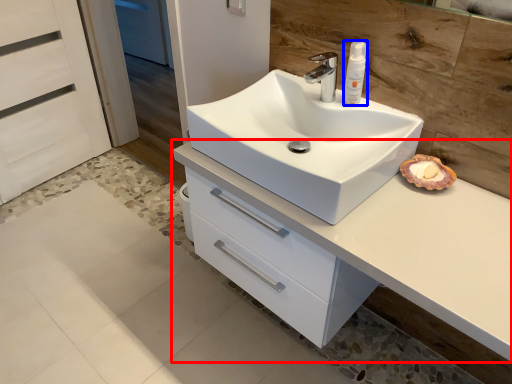
Question: Which point is closer to the camera, bathroom cabinet (highlighted by a red box) or toiletry (highlighted by a blue box)?

Choices:
 (A) bathroom cabinet
 (B) toiletry

Answer: (A)